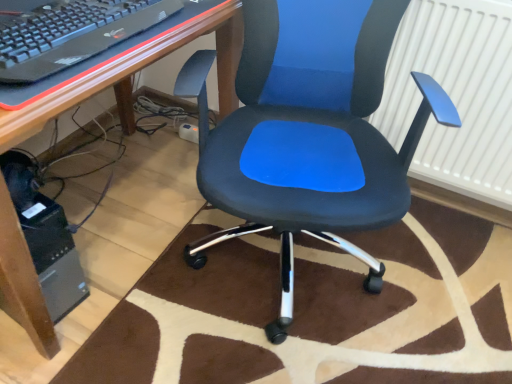
What do you see at coordinates (73, 35) in the screenshot? I see `black plastic keyboard at upper left` at bounding box center [73, 35].

The width and height of the screenshot is (512, 384). Find the location of `black plastic keyboard at upper left`. black plastic keyboard at upper left is located at coordinates (73, 35).

Find the location of `white textured radiator at upper right`. white textured radiator at upper right is located at coordinates (455, 94).

Image resolution: width=512 pixels, height=384 pixels. What do you see at coordinates (316, 310) in the screenshot?
I see `brown plush rug at center` at bounding box center [316, 310].

Find the location of a particular element. This screenshot has height=384, width=512. black plastic keyboard at upper left is located at coordinates click(x=133, y=74).

Is black plastic computer tower at lower left positioned with its back to matte black desk at center?

Yes, matte black desk at center is at the back of black plastic computer tower at lower left.

Is black plastic computer tower at lower left not within matte black desk at center?

No, most part of black plastic computer tower at lower left lies within matte black desk at center.

Which is behind, point (63, 290) or point (7, 242)?

The point (63, 290) is farther from the camera.

Does matte black desk at center come behind black plastic computer tower at lower left?

No, it is not.

Is matte black desk at center next to black plastic computer tower at lower left and touching it?

No, matte black desk at center is not in contact with black plastic computer tower at lower left.

Can you tell me how much matte black desk at center and black plastic computer tower at lower left differ in facing direction?

matte black desk at center and black plastic computer tower at lower left are facing 4.26 degrees away from each other.

Is matte black desk at center to the left of black plastic computer tower at lower left from the viewer's perspective?

No, matte black desk at center is not to the left of black plastic computer tower at lower left.

Locate an element on the screen. desk that appears on the left of white textured radiator at upper right is located at coordinates (134, 73).

From the picture: From the image's perspective, is matte black desk at center located beneath white textured radiator at upper right?

Yes, from the image's perspective, matte black desk at center is beneath white textured radiator at upper right.

Considering the sizes of objects matte black desk at center and white textured radiator at upper right in the image provided, who is taller, matte black desk at center or white textured radiator at upper right?

matte black desk at center is taller.

Between matte black desk at center and white textured radiator at upper right, which one has larger width?

matte black desk at center.

Is point (224, 76) positioned in front of point (115, 11)?

No.

From a real-world perspective, which object stands above the other?

black plastic keyboard at upper left, from a real-world perspective.

Is the position of matte black desk at center more distant than that of black plastic keyboard at upper left?

No, it is not.

Considering the relative sizes of matte black desk at center and black plastic keyboard at upper left in the image provided, is matte black desk at center bigger than black plastic keyboard at upper left?

Indeed, matte black desk at center has a larger size compared to black plastic keyboard at upper left.

Is black plastic keyboard at upper left bigger or smaller than brown plush rug at center?

Considering their sizes, black plastic keyboard at upper left takes up less space than brown plush rug at center.

Considering the sizes of objects black plastic keyboard at upper left and brown plush rug at center in the image provided, who is wider, black plastic keyboard at upper left or brown plush rug at center?

brown plush rug at center.

The width and height of the screenshot is (512, 384). I want to click on computer keyboard that is above the brown plush rug at center (from the image's perspective), so click(73, 35).

How different are the orientations of black plastic keyboard at upper left and matte black office chair at center in degrees?

black plastic keyboard at upper left and matte black office chair at center are facing 66 degrees away from each other.

Measure the distance between black plastic keyboard at upper left and matte black office chair at center.

black plastic keyboard at upper left and matte black office chair at center are 14.74 inches apart from each other.

Is black plastic keyboard at upper left smaller than matte black office chair at center?

Yes, black plastic keyboard at upper left is smaller than matte black office chair at center.

Which object is further away from the camera taking this photo, black plastic keyboard at upper left or matte black office chair at center?

Positioned behind is black plastic keyboard at upper left.

From their relative heights in the image, would you say matte black office chair at center is taller or shorter than black plastic keyboard at upper left?

Clearly, matte black office chair at center is taller compared to black plastic keyboard at upper left.

I want to click on chair below the black plastic keyboard at upper left (from the image's perspective), so click(308, 131).

Is matte black office chair at center in front of or behind black plastic keyboard at upper left in the image?

In the image, matte black office chair at center appears in front of black plastic keyboard at upper left.

Is matte black office chair at center far away from black plastic keyboard at upper left?

They are positioned close to each other.

I want to click on desk that appears on the right of black plastic computer tower at lower left, so click(134, 73).

Image resolution: width=512 pixels, height=384 pixels. What are the coordinates of `computer tower behind the matte black desk at center` in the screenshot? It's located at (54, 256).

From the picture: From the image, which object appears to be farther from matte black office chair at center, black plastic keyboard at upper left or brown plush rug at center?

Based on the image, brown plush rug at center appears to be further to matte black office chair at center.

Estimate the real-world distances between objects in this image. Which object is closer to brown plush rug at center, matte black office chair at center or black plastic keyboard at upper left?

matte black office chair at center.

Estimate the real-world distances between objects in this image. Which object is further from brown plush rug at center, black plastic computer tower at lower left or black plastic keyboard at upper left?

black plastic keyboard at upper left is further to brown plush rug at center.

Looking at the image, which one is located closer to matte black office chair at center, matte black desk at center or black plastic keyboard at upper left?

matte black desk at center lies closer to matte black office chair at center than the other object.

Considering their positions, is brown plush rug at center positioned closer to black plastic computer tower at lower left than white textured radiator at upper right?

brown plush rug at center is positioned closer to the anchor black plastic computer tower at lower left.

When comparing their distances from black plastic keyboard at upper left, does matte black office chair at center or black plastic computer tower at lower left seem further?

black plastic computer tower at lower left is further to black plastic keyboard at upper left.

Considering their positions, is black plastic keyboard at upper left positioned further to matte black desk at center than black plastic computer tower at lower left?

Based on the image, black plastic computer tower at lower left appears to be further to matte black desk at center.

Looking at the image, which one is located further to black plastic keyboard at upper left, black plastic computer tower at lower left or matte black office chair at center?

The object further to black plastic keyboard at upper left is black plastic computer tower at lower left.

At what (x,y) coordinates should I click in order to perform the action: click on computer keyboard that lies between black plastic keyboard at upper left and black plastic computer tower at lower left from top to bottom. Please return your answer as a coordinate pair (x, y). Looking at the image, I should click on (73, 35).

Find the location of `chair located between matte black desk at center and brown plush rug at center in the left-right direction`. chair located between matte black desk at center and brown plush rug at center in the left-right direction is located at coordinates (308, 131).

The image size is (512, 384). What are the coordinates of `mat located between black plastic computer tower at lower left and white textured radiator at upper right in the left-right direction` in the screenshot? It's located at (316, 310).

The image size is (512, 384). What are the coordinates of `computer desk located between matte black desk at center and matte black office chair at center in the left-right direction` in the screenshot? It's located at (133, 74).